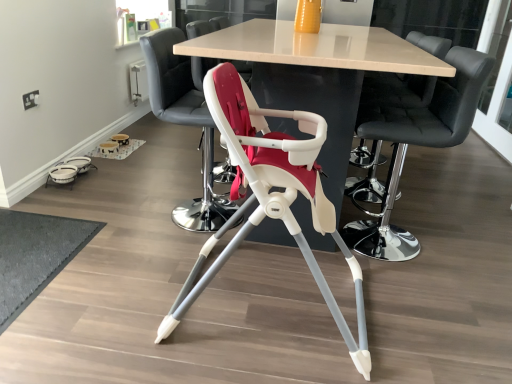
Where is `empty space that is ontop of dark gray textured mat at lower left (from a real-world perspective)`? empty space that is ontop of dark gray textured mat at lower left (from a real-world perspective) is located at coordinates (30, 245).